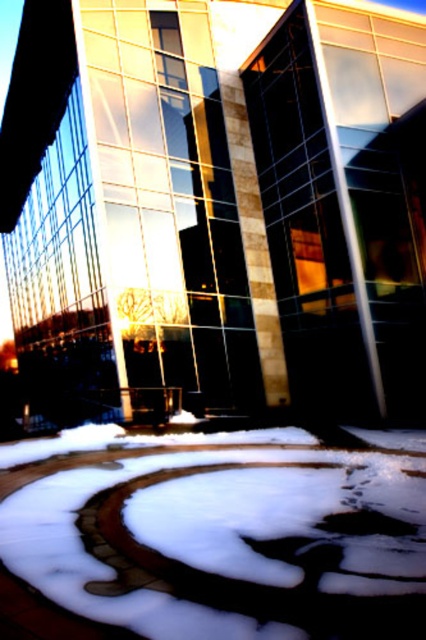
Question: Which point is farther to the camera?

Choices:
 (A) (337, 518)
 (B) (100, 492)

Answer: (B)

Question: Does white concrete pavement at lower center appear on the right side of brown textured footprint at center?

Choices:
 (A) yes
 (B) no

Answer: (B)

Question: Can you confirm if white concrete pavement at lower center is smaller than brown textured footprint at center?

Choices:
 (A) no
 (B) yes

Answer: (B)

Question: Which object is farther from the camera taking this photo?

Choices:
 (A) white concrete pavement at lower center
 (B) brown textured footprint at center

Answer: (A)

Question: Which object is farther from the camera taking this photo?

Choices:
 (A) white concrete pavement at lower center
 (B) brown textured footprint at center

Answer: (A)

Question: Can you confirm if white concrete pavement at lower center is wider than brown textured footprint at center?

Choices:
 (A) no
 (B) yes

Answer: (B)